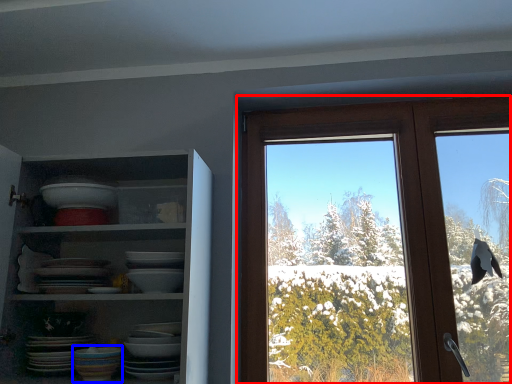
Question: Which of the following is the closest to the observer, window (highlighted by a red box) or tableware (highlighted by a blue box)?

Choices:
 (A) window
 (B) tableware

Answer: (B)